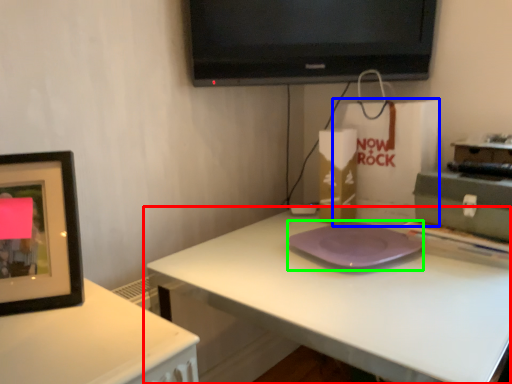
Question: Which object is the closest to the table (highlighted by a red box)? Choose among these: paper bag (highlighted by a blue box) or pad (highlighted by a green box).

Choices:
 (A) paper bag
 (B) pad

Answer: (B)